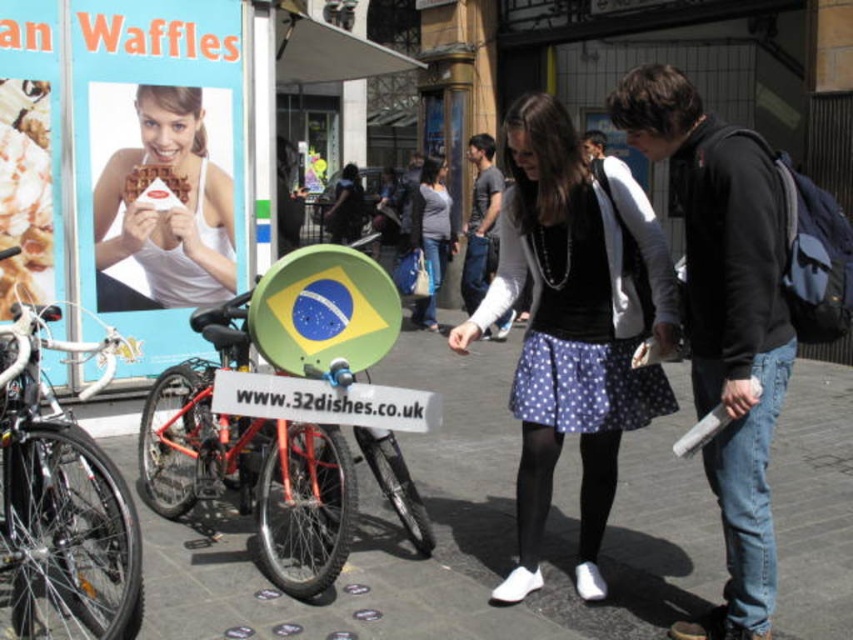
Is dark blue jeans at center wider than white plastic sign at center?

No, dark blue jeans at center is not wider than white plastic sign at center.

Who is positioned more to the left, dark blue jeans at center or white plastic sign at center?

white plastic sign at center

Identify the location of dark blue jeans at center. This screenshot has width=853, height=640. (724, 320).

Can you confirm if orange metallic bicycle at center is positioned below matte gray sweater at center?

Correct, orange metallic bicycle at center is located below matte gray sweater at center.

Find the location of a particular element. Image resolution: width=853 pixels, height=640 pixels. orange metallic bicycle at center is located at coordinates (248, 461).

In the scene shown: Who is more forward, (3, 38) or (436, 198)?

Point (3, 38) is in front.

Is matte white billboard at upper left closer to the viewer compared to matte gray sweater at center?

Yes, it is.

What do you see at coordinates (126, 163) in the screenshot? I see `matte white billboard at upper left` at bounding box center [126, 163].

You are a GUI agent. You are given a task and a screenshot of the screen. Output one action in this format:
    pyautogui.click(x=<x>, y=<y>)
    Task: Click on the matte white billboard at upper left
    This screenshot has height=640, width=853.
    Given the screenshot: What is the action you would take?
    pyautogui.click(x=126, y=163)